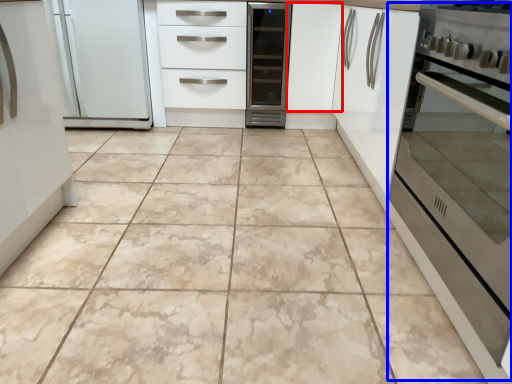
Question: Which object is closer to the camera taking this photo, cabinetry (highlighted by a red box) or oven (highlighted by a blue box)?

Choices:
 (A) cabinetry
 (B) oven

Answer: (B)